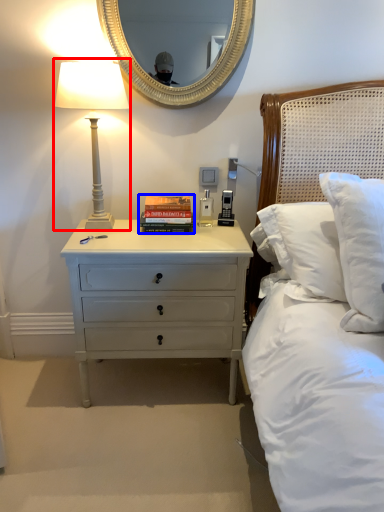
Question: Which object is closer to the camera taking this photo, bedside lamp (highlighted by a red box) or paperback book (highlighted by a blue box)?

Choices:
 (A) bedside lamp
 (B) paperback book

Answer: (A)